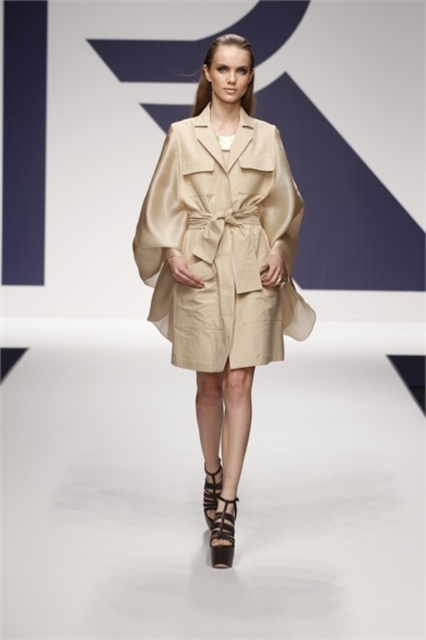
You are a fashion designer observing the runway show and need to decide whether the beige satin coat at center can be paired with the brown leather sandal at lower center based on their height. Can the coat be paired with the sandal without any issues?

The beige satin coat at center is taller than the brown leather sandal at lower center, so pairing them is possible as the coat will not interfere with the sandal.